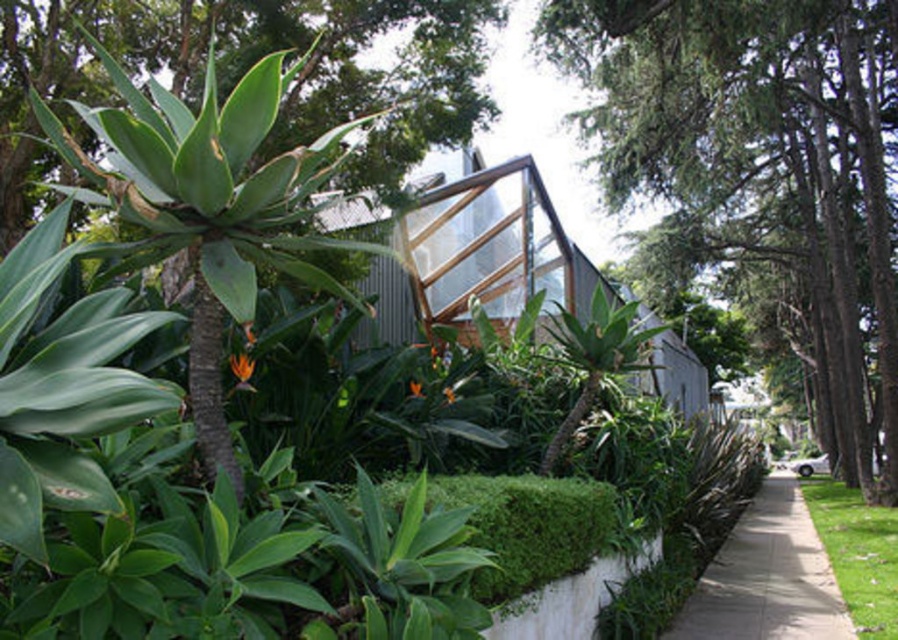
You are a gardener planning to plant a new row of plants in the garden. You have the green leafy plant at center and the green grass at lower right. Which of these two has a thicker stem?

The green grass at lower right has a thicker stem than the green leafy plant at center.

In the scene shown: You are standing in the garden and see both the green leafy tree at center and the green leafy plant at center. Which one is located to the right of the other?

The green leafy tree at center is positioned on the right side of the green leafy plant at center.

You are standing in the garden and want to walk towards the building. Which object, the green leafy plant at center or the green grass at lower right, would you encounter first?

The green leafy plant at center is in front of the green grass at lower right, so you would encounter the green leafy plant at center first when walking towards the building.